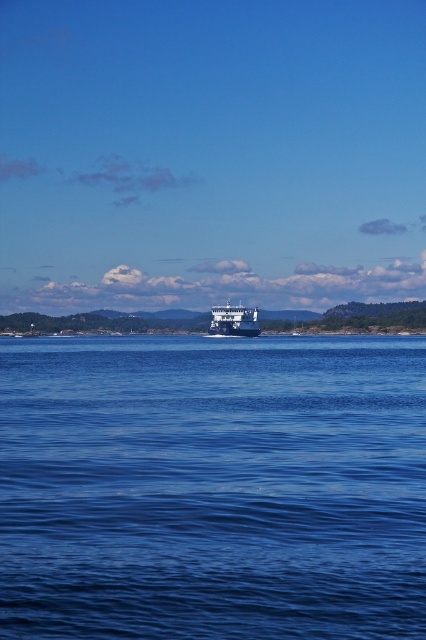
Is blue liquid water at center below blue metallic cruise ship at center?

Yes, blue liquid water at center is below blue metallic cruise ship at center.

Is point (203, 568) positioned behind point (252, 326)?

No.

The image size is (426, 640). Identify the location of blue liquid water at center. (213, 486).

Where is `blue liquid water at center`? Image resolution: width=426 pixels, height=640 pixels. blue liquid water at center is located at coordinates tap(213, 486).